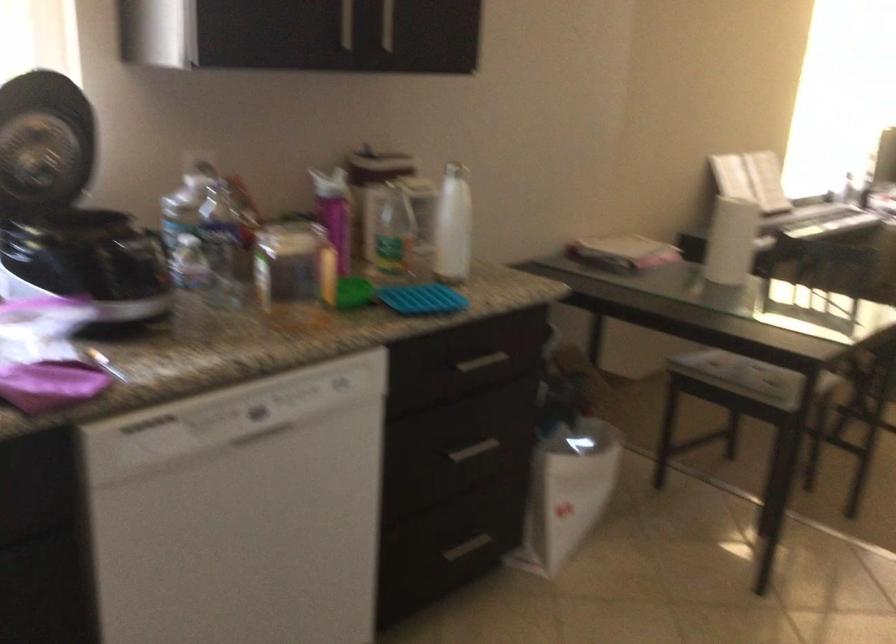
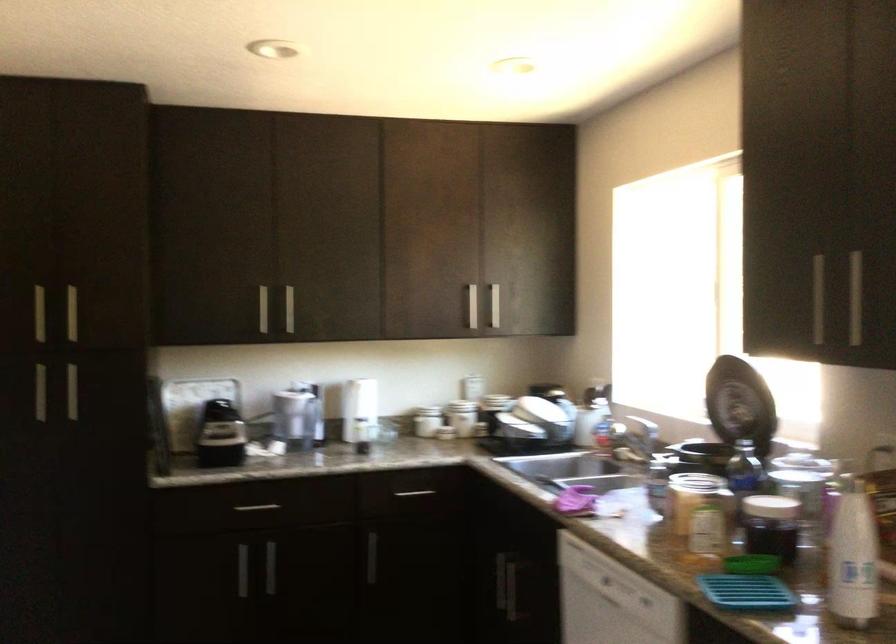
Where in the second image is the point corresponding to point (410, 193) from the first image?

(853, 556)